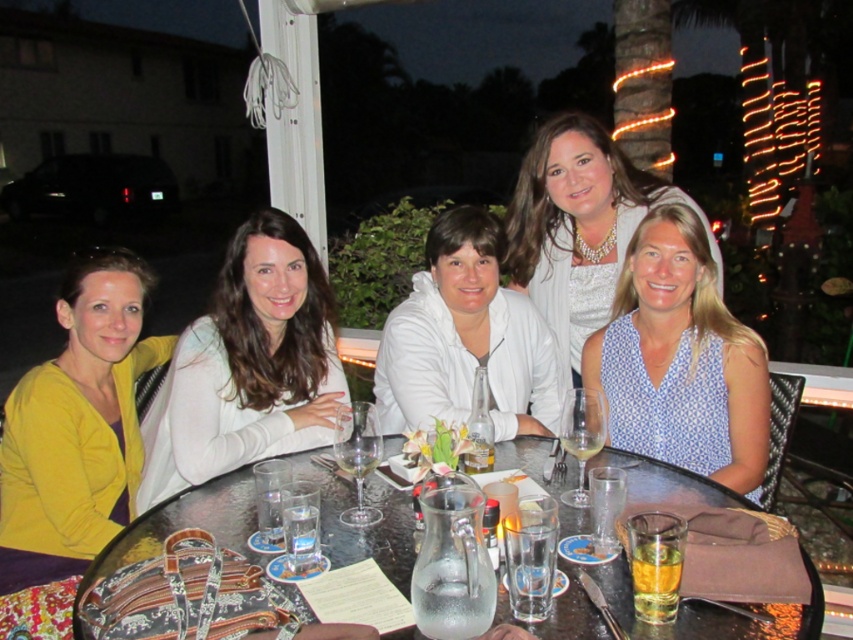
Question: Which point is closer to the camera?

Choices:
 (A) clear glass wine at center
 (B) smooth white blouse at center

Answer: (A)

Question: Which object is positioned closest to the translucent glass at lower right?

Choices:
 (A) clear glass table at center
 (B) blue printed dress at center
 (C) clear glass wine at center

Answer: (A)

Question: Is smooth white blouse at center thinner than white matte jacket at center?

Choices:
 (A) yes
 (B) no

Answer: (A)

Question: Can you confirm if translucent glass wine at center is positioned above clear glass wine at center?

Choices:
 (A) yes
 (B) no

Answer: (A)

Question: Which object appears closest to the camera in this image?

Choices:
 (A) translucent glass at lower right
 (B) clear glass wine at center

Answer: (A)

Question: Can you confirm if yellow matte sweater at lower left is wider than blue printed dress at center?

Choices:
 (A) yes
 (B) no

Answer: (B)